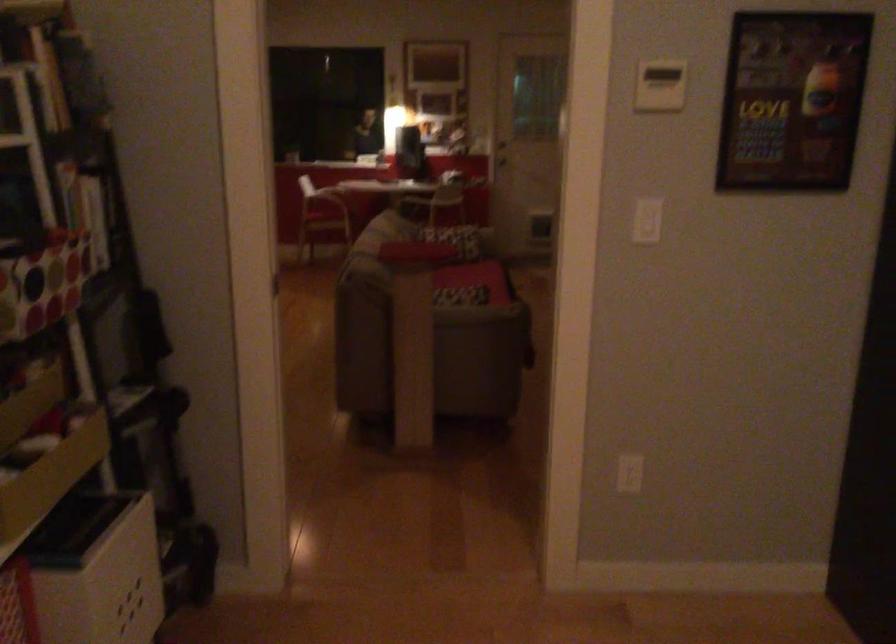
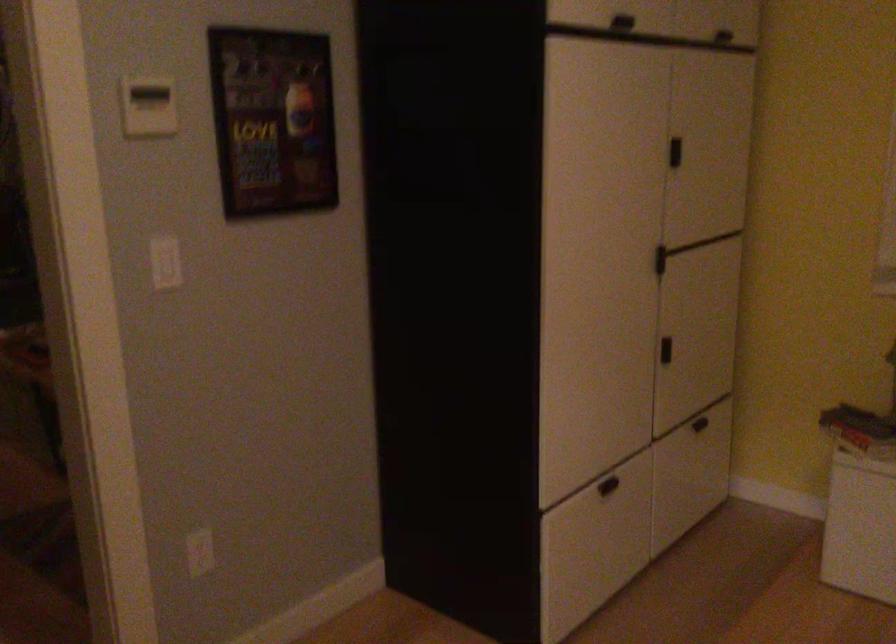
Question: The camera is either moving clockwise (left) or counter-clockwise (right) around the object. The first image is from the beginning of the video and the second image is from the end. Is the camera moving left or right when shooting the video?

Choices:
 (A) Left
 (B) Right

Answer: (A)